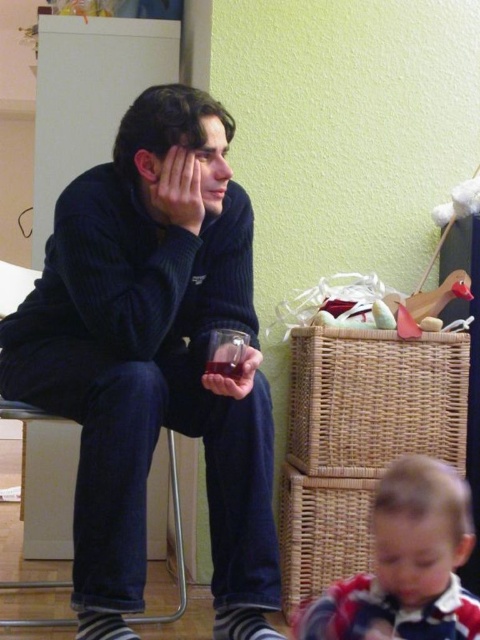
Question: Considering the real-world distances, which object is closest to the dark blue corduroy chair at left?

Choices:
 (A) dark corduroy sweater at left
 (B) translucent glass at lower center
 (C) red and white striped shirt at lower right

Answer: (A)

Question: Is red and white striped shirt at lower right thinner than dark blue corduroy chair at left?

Choices:
 (A) yes
 (B) no

Answer: (A)

Question: Based on their relative distances, which object is farther from the dark blue corduroy chair at left?

Choices:
 (A) translucent glass at lower center
 (B) translucent plastic cup at lower center
 (C) dark corduroy sweater at left
 (D) red and white striped shirt at lower right

Answer: (D)

Question: Considering the relative positions of translucent plastic cup at lower center and translucent glass at lower center in the image provided, where is translucent plastic cup at lower center located with respect to translucent glass at lower center?

Choices:
 (A) above
 (B) below

Answer: (B)

Question: Can you confirm if dark corduroy sweater at left is smaller than translucent glass at lower center?

Choices:
 (A) no
 (B) yes

Answer: (A)

Question: Which of the following is the closest to the observer?

Choices:
 (A) (239, 381)
 (B) (411, 470)

Answer: (B)